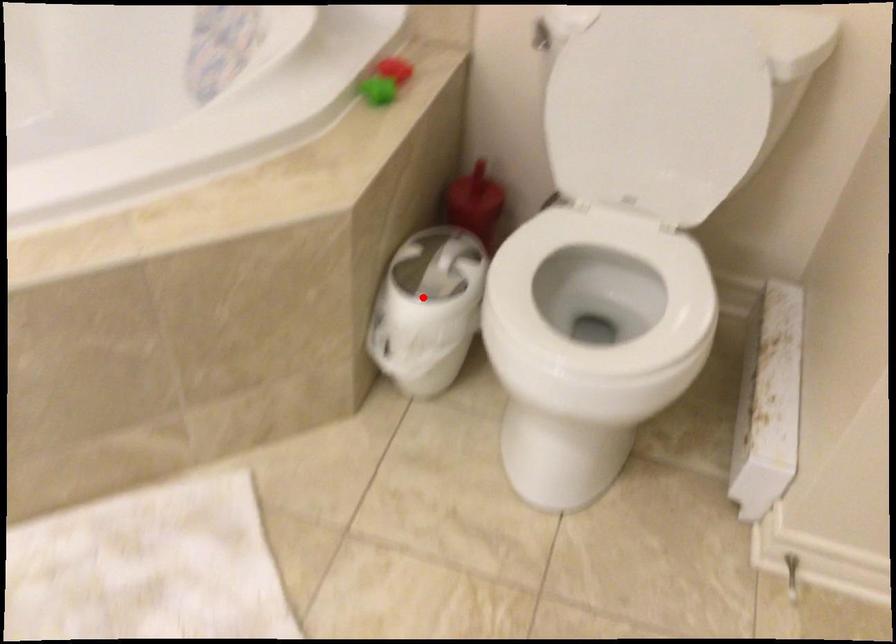
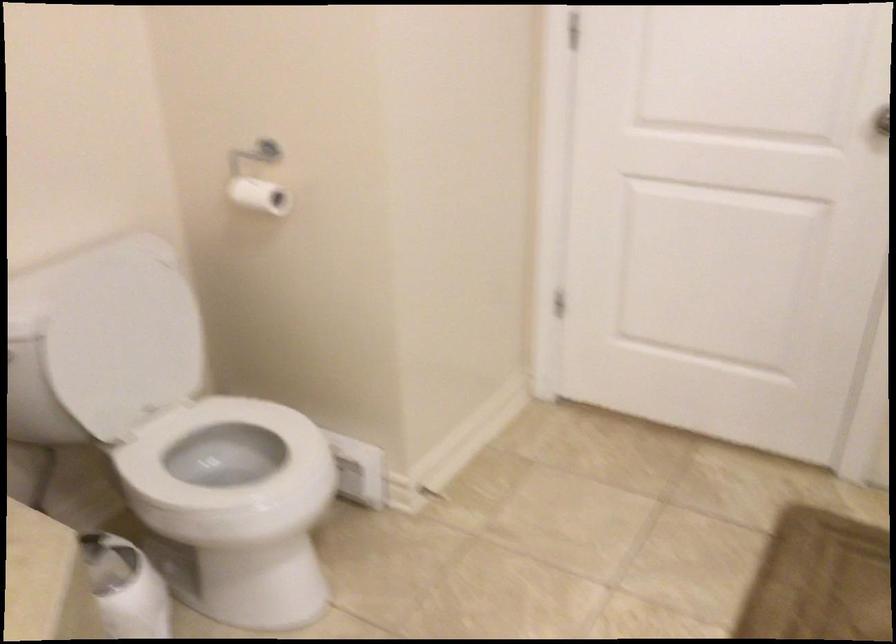
Locate, in the second image, the point that corresponds to the highlighted location in the first image.

(125, 587)